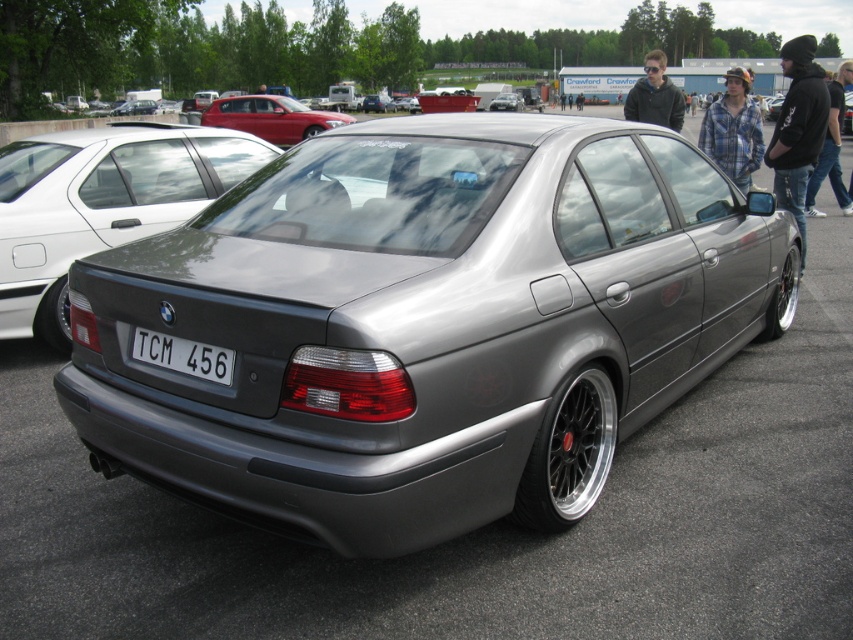
Question: Can you confirm if white plastic license plate at center is bigger than satin silver sedan at center?

Choices:
 (A) yes
 (B) no

Answer: (B)

Question: Among these points, which one is farthest from the camera?

Choices:
 (A) (144, 353)
 (B) (384, 106)

Answer: (B)

Question: Which is nearer to the satin silver car at center?

Choices:
 (A) satin silver sedan at center
 (B) metallic red sedan at upper center
 (C) white plastic license plate at center

Answer: (A)

Question: Can you confirm if metallic red sedan at upper center is wider than satin silver sedan at center?

Choices:
 (A) yes
 (B) no

Answer: (A)

Question: Which point is closer to the camera taking this photo?

Choices:
 (A) (323, 113)
 (B) (376, 108)
 (C) (194, 376)
 (D) (512, 93)

Answer: (C)

Question: Does metallic red sedan at upper center appear on the left side of satin silver car at center?

Choices:
 (A) no
 (B) yes

Answer: (B)